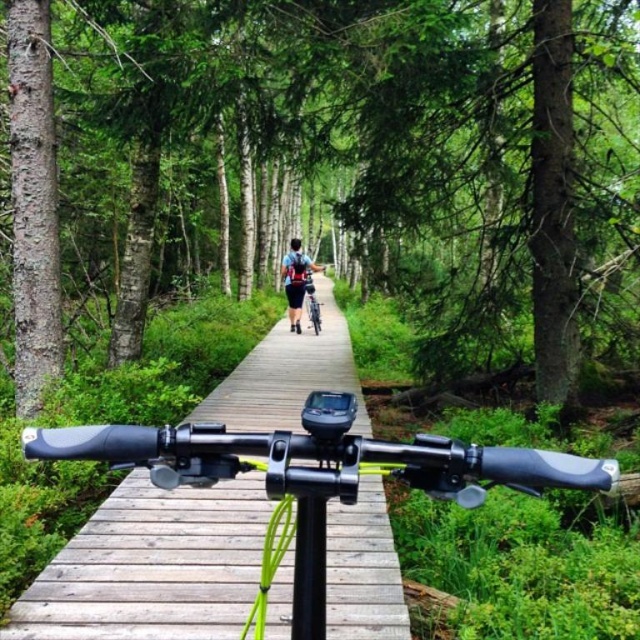
Describe the element at coordinates (333, 164) in the screenshot. This screenshot has height=640, width=640. I see `green matte tree at center` at that location.

At what (x,y) coordinates should I click in order to perform the action: click on green matte tree at center. Please return your answer as a coordinate pair (x, y). Looking at the image, I should click on (333, 164).

Is the position of dark blue fabric backpack at center more distant than that of silver metallic bicycle at center?

No, dark blue fabric backpack at center is closer to the viewer.

Measure the distance between dark blue fabric backpack at center and camera.

10.82 meters

Find the location of `dark blue fabric backpack at center`. dark blue fabric backpack at center is located at coordinates (296, 280).

Where is `dark blue fabric backpack at center`? dark blue fabric backpack at center is located at coordinates (296, 280).

Is green matte tree at center thinner than wooden boardwalk at center?

No.

Between green matte tree at center and wooden boardwalk at center, which one has less height?

wooden boardwalk at center

At what (x,y) coordinates should I click in order to perform the action: click on green matte tree at center. Please return your answer as a coordinate pair (x, y). Looking at the image, I should click on (333, 164).

Locate an element on the screen. green matte tree at center is located at coordinates (333, 164).